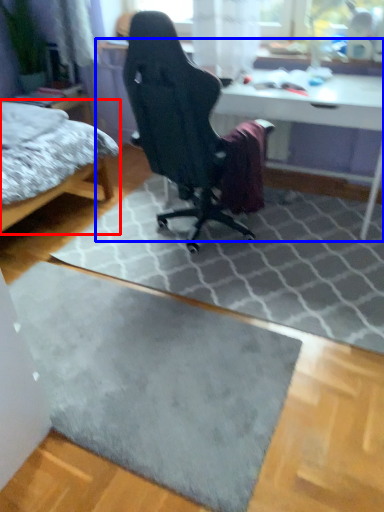
Question: Which point is further to the camera, bed (highlighted by a red box) or table (highlighted by a blue box)?

Choices:
 (A) bed
 (B) table

Answer: (B)